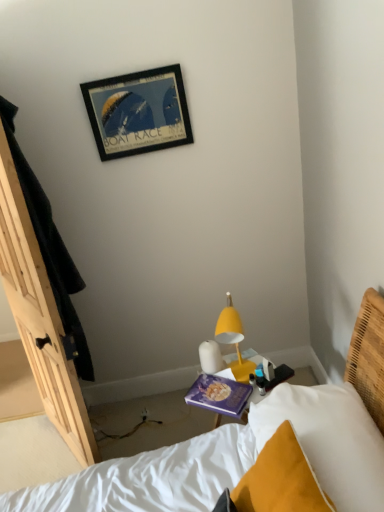
Question: Considering the positions of yellow matte lamp at center-right and white soft pillow at lower right in the image, is yellow matte lamp at center-right bigger or smaller than white soft pillow at lower right?

Choices:
 (A) big
 (B) small

Answer: (B)

Question: Considering the positions of yellow matte lamp at center-right and white soft pillow at lower right in the image, is yellow matte lamp at center-right taller or shorter than white soft pillow at lower right?

Choices:
 (A) tall
 (B) short

Answer: (B)

Question: Which object is the farthest from the purple matte book at center?

Choices:
 (A) white soft pillow at lower right
 (B) yellow matte lamp at center-right
 (C) black matte picture frame at upper center

Answer: (C)

Question: Which is farther from the black matte picture frame at upper center?

Choices:
 (A) white soft pillow at lower right
 (B) purple matte book at center
 (C) yellow matte lamp at center-right

Answer: (A)